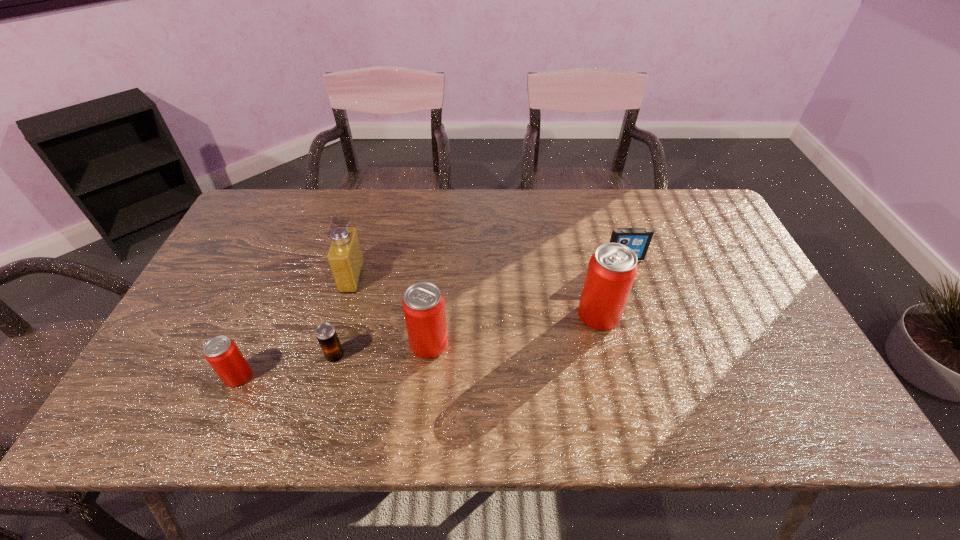
Locate an element on the screen. This screenshot has width=960, height=540. free space at the far left corner is located at coordinates (251, 203).

Locate an element on the screen. free location at the far right corner is located at coordinates (676, 199).

The height and width of the screenshot is (540, 960). In order to click on vacant space at the near right corner of the desktop in this screenshot , I will do `click(750, 379)`.

Find the location of a particular element. This screenshot has width=960, height=540. free space that is in between the perfume and the third object from right to left is located at coordinates (391, 310).

Locate an element on the screen. free point between the beer can and the second object from right to left is located at coordinates coord(467,336).

The height and width of the screenshot is (540, 960). Find the location of `unoccupied position between the leftmost can and the beer can`. unoccupied position between the leftmost can and the beer can is located at coordinates (287, 366).

The width and height of the screenshot is (960, 540). Identify the location of vacant space in between the perfume and the farthest object. (489, 267).

What are the coordinates of `empty space that is in between the rightmost can and the second can from right to left` in the screenshot? It's located at (514, 329).

The width and height of the screenshot is (960, 540). What are the coordinates of `vacant area that lies between the rightmost object and the perfume` in the screenshot? It's located at (489, 267).

This screenshot has height=540, width=960. I want to click on vacant area that lies between the second can from right to left and the rightmost can, so click(x=514, y=329).